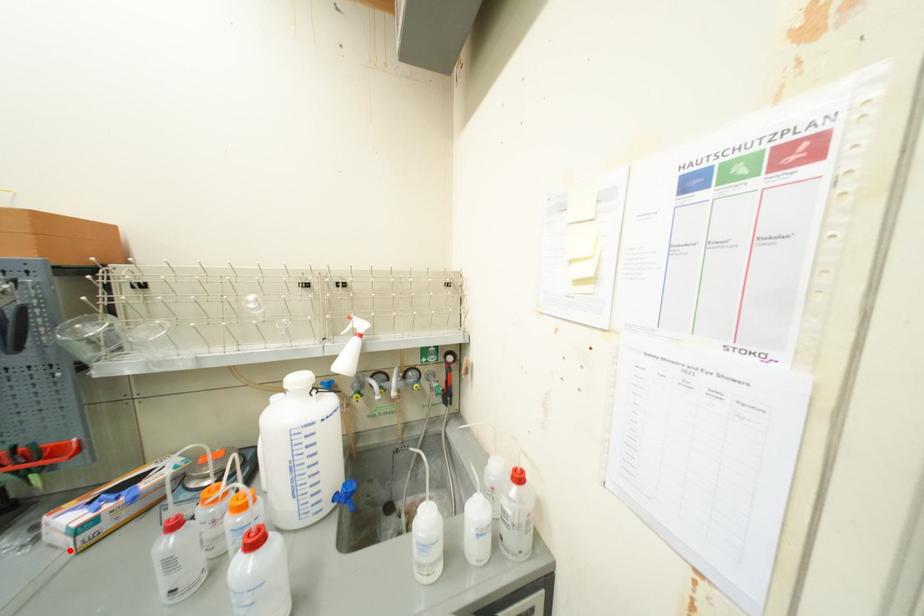
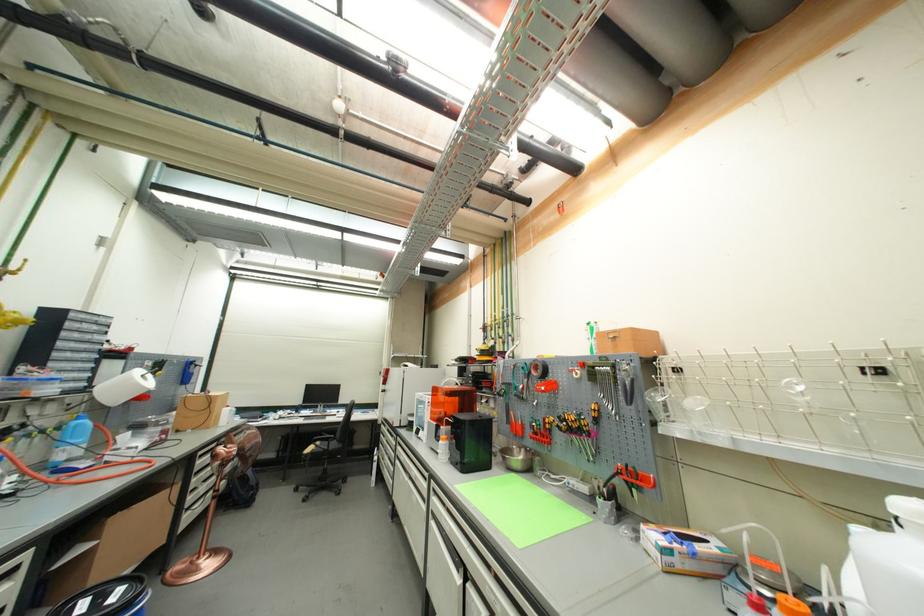
The point at the highlighted location is marked in the first image. Where is the corresponding point in the second image?

(661, 561)